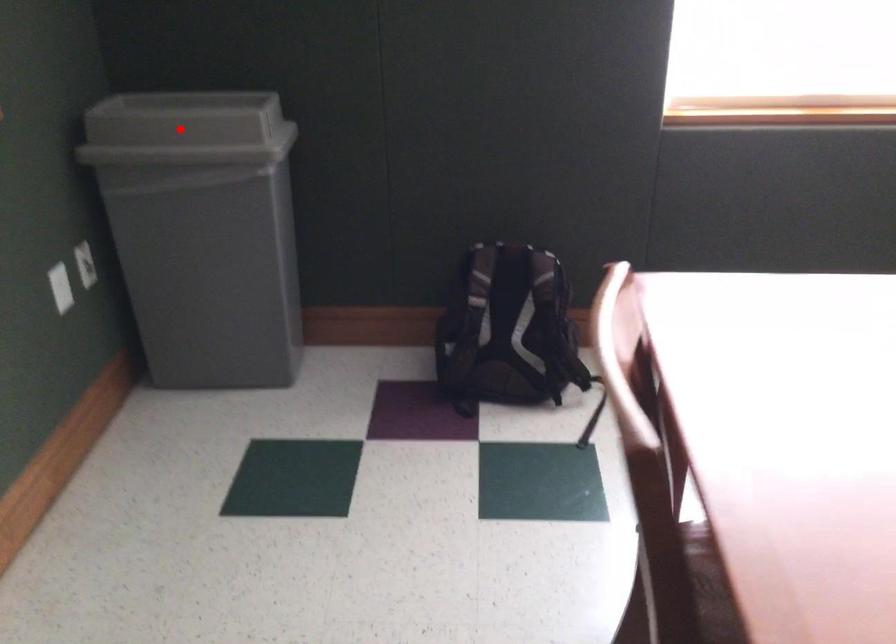
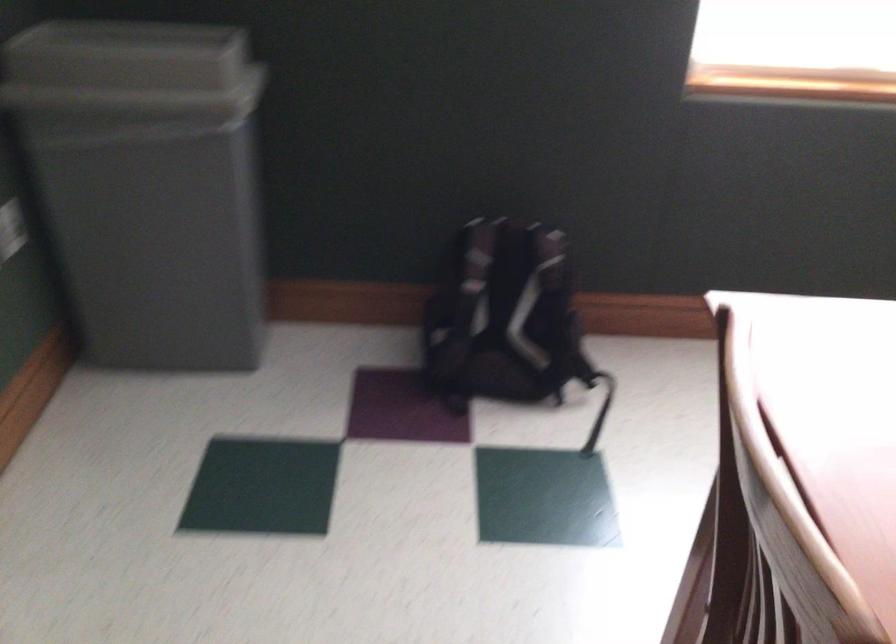
Question: I am providing you with two images of the same scene from different viewpoints. Given a red point in image1, look at the same physical point in image2. Is it:

Choices:
 (A) Closer to the viewpoint
 (B) Farther from the viewpoint

Answer: (A)